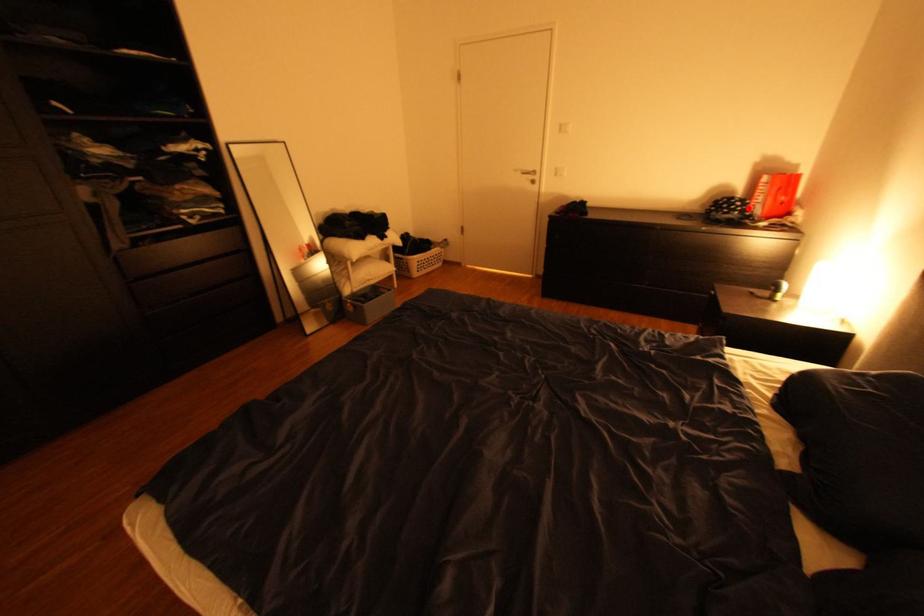
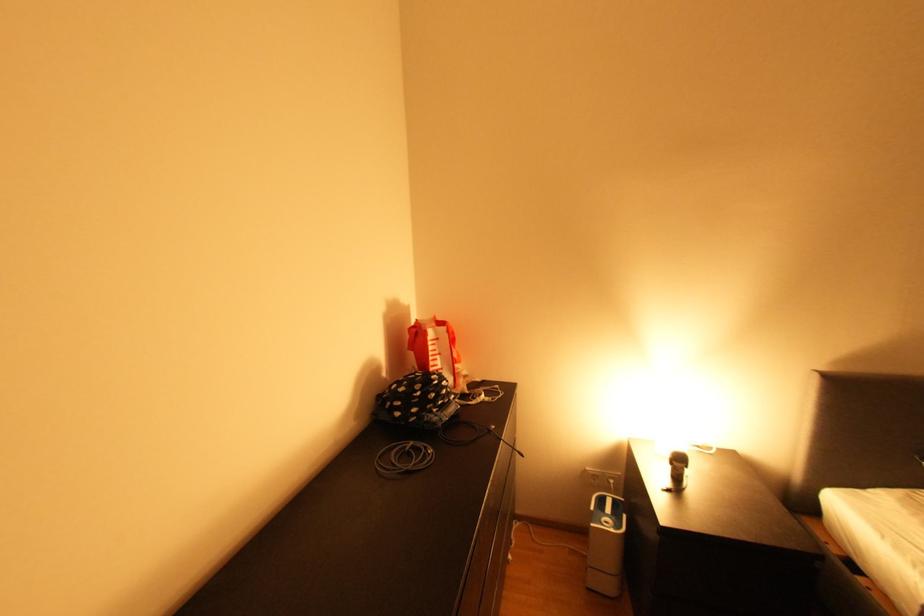
Locate, in the second image, the point that corresponds to the highlighted location in the first image.

(457, 389)